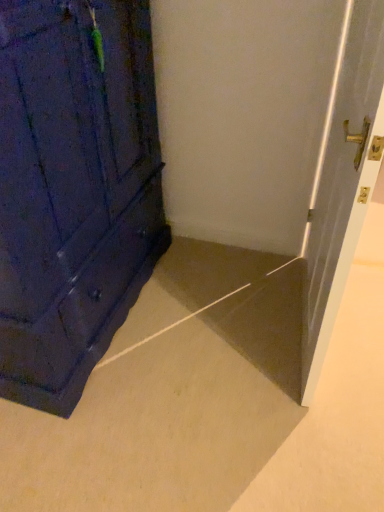
Question: Should I look upward or downward to see satin silver door at right?

Choices:
 (A) down
 (B) up

Answer: (B)